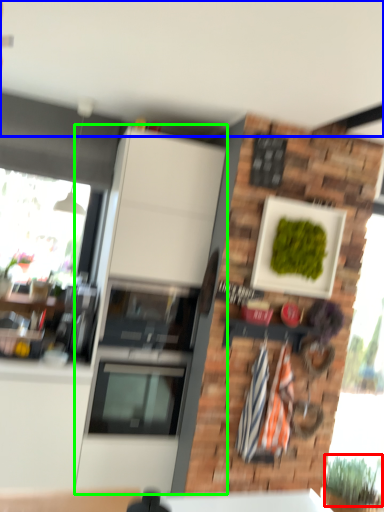
Question: Which object is the closest to the plant (highlighted by a red box)? Choose among these: backdrop (highlighted by a blue box) or cabinetry (highlighted by a green box).

Choices:
 (A) backdrop
 (B) cabinetry

Answer: (B)